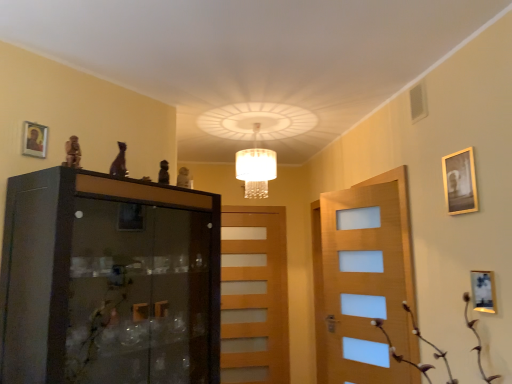
Find the location of a particular element. This screenshot has width=512, height=384. empty space that is ontop of light brown wooden door at center (from a real-world perspective) is located at coordinates (249, 213).